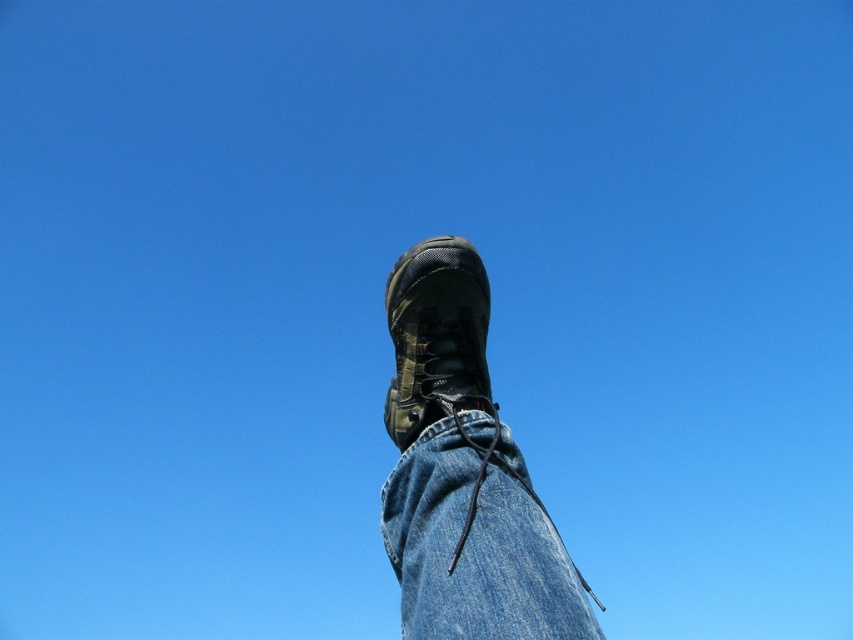
Which is more to the right, denim at center or matte black boot at center?

denim at center is more to the right.

This screenshot has height=640, width=853. What do you see at coordinates (476, 541) in the screenshot? I see `denim at center` at bounding box center [476, 541].

Locate an element on the screen. This screenshot has width=853, height=640. denim at center is located at coordinates (476, 541).